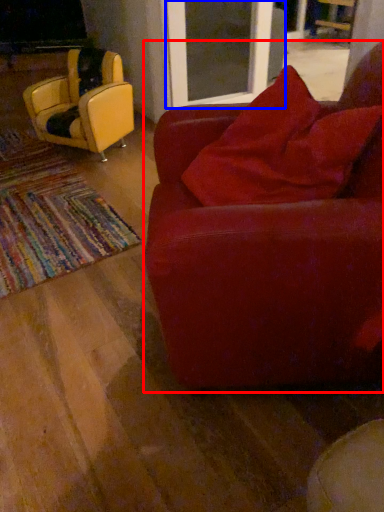
Question: Which object is closer to the camera taking this photo, chair (highlighted by a red box) or screen door (highlighted by a blue box)?

Choices:
 (A) chair
 (B) screen door

Answer: (A)